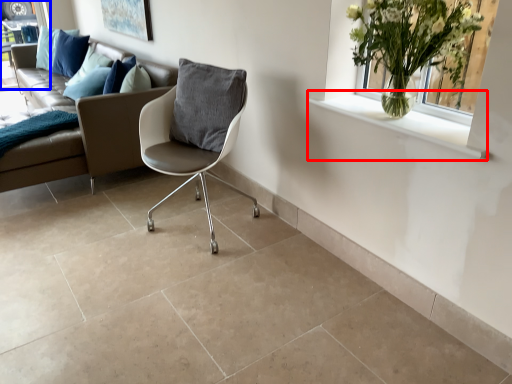
Question: Which point is further to the camera, window sill (highlighted by a red box) or window frame (highlighted by a blue box)?

Choices:
 (A) window sill
 (B) window frame

Answer: (B)